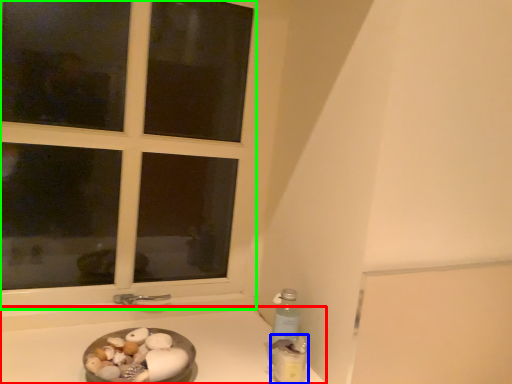
Question: Which object is the farthest from counter top (highlighted by a red box)? Choose among these: bottle (highlighted by a blue box) or window (highlighted by a green box).

Choices:
 (A) bottle
 (B) window

Answer: (B)